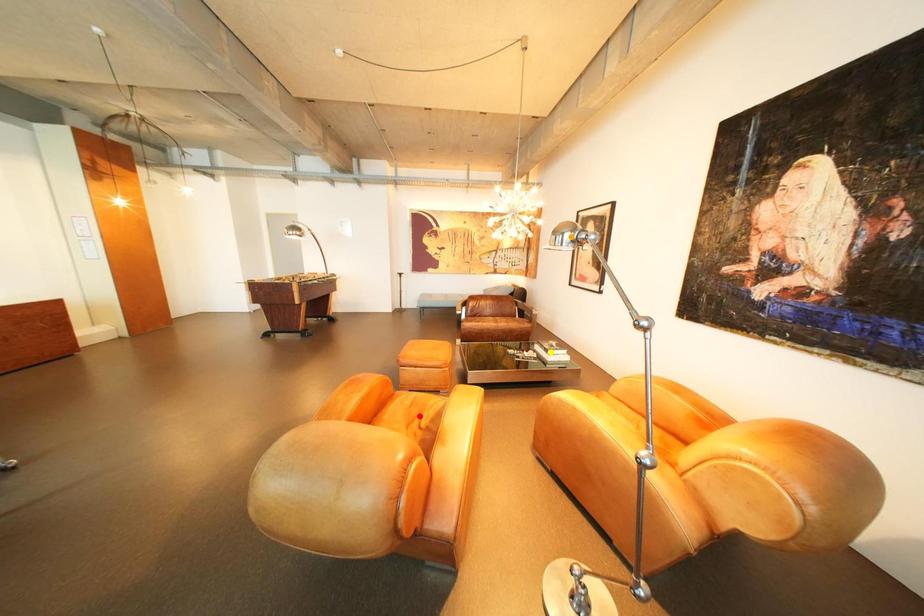
Order these from nearest to farthest:
1. red point
2. yellow point
3. orange point

red point → yellow point → orange point